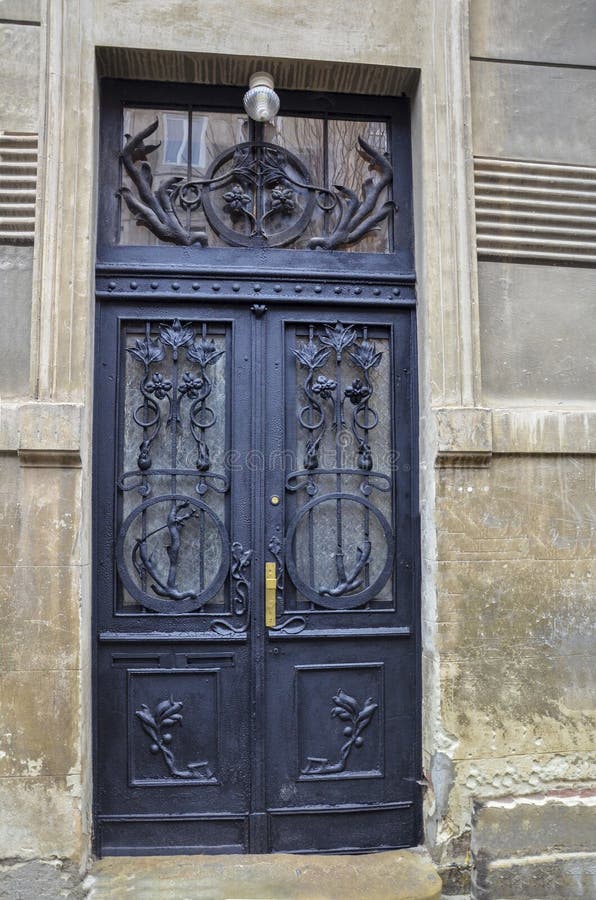
Locate an element on the screen. This screenshot has width=596, height=900. door handle is located at coordinates (269, 589).